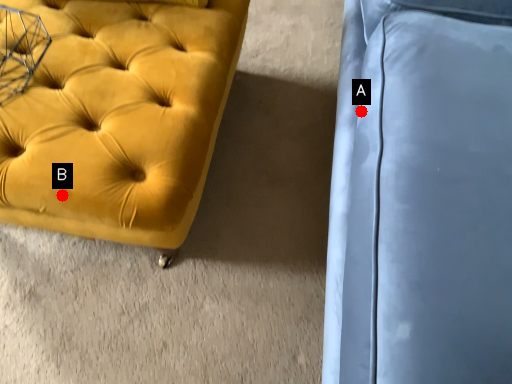
Question: Two points are circled on the image, labeled by A and B beside each circle. Which of the following is the closest to the observer?

Choices:
 (A) A is closer
 (B) B is closer

Answer: (B)